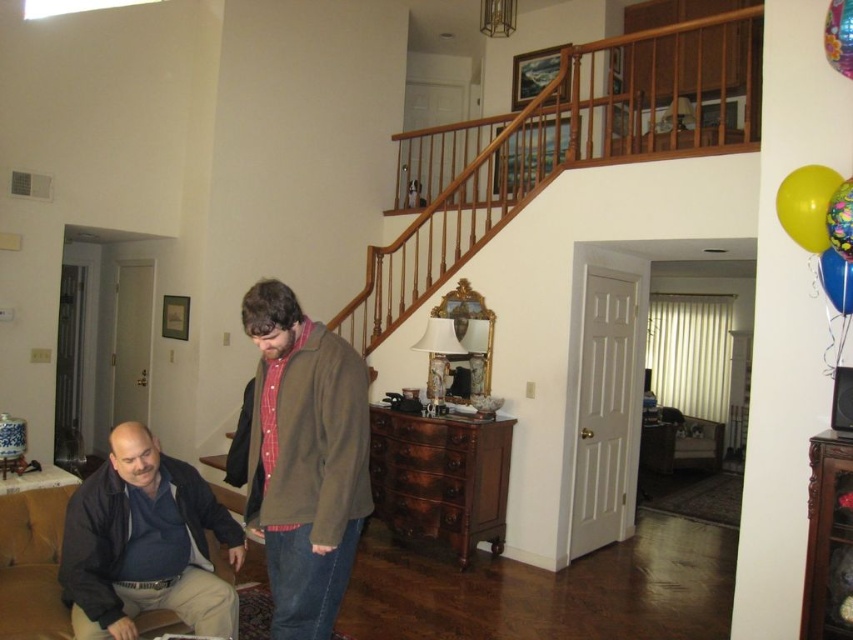
You are standing in the living room and want to reach the yellow rubber balloon at upper right without moving the dark blue jacket at lower left. Is this possible?

The dark blue jacket at lower left is closer to the viewer than the yellow rubber balloon at upper right, so you can reach the yellow rubber balloon at upper right without moving the dark blue jacket at lower left because the balloon is further away and accessible from another angle.

You are standing in the living room and want to reach the yellow matte balloon at upper right without moving the dark blue jacket at lower left. Is this possible?

The dark blue jacket at lower left is closer to the viewer than the yellow matte balloon at upper right, so you can reach the yellow matte balloon at upper right without moving the dark blue jacket at lower left because the balloon is further away and accessible from another path.